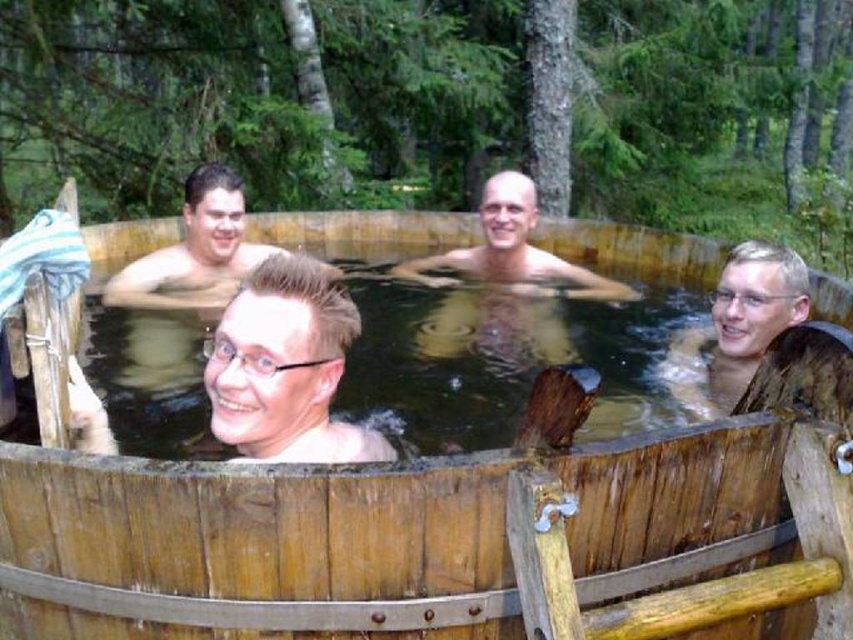
Can you confirm if smooth skin at right is thinner than matte skin at center?

Correct, smooth skin at right's width is less than matte skin at center's.

Does smooth skin at right have a greater width compared to matte skin at center?

Incorrect, smooth skin at right's width does not surpass matte skin at center's.

Describe the element at coordinates (737, 326) in the screenshot. This screenshot has height=640, width=853. I see `smooth skin at right` at that location.

Where is `smooth skin at right`? The width and height of the screenshot is (853, 640). smooth skin at right is located at coordinates (737, 326).

Can you confirm if wooden hot tub at center is positioned to the right of clear plastic glasses at center?

Correct, you'll find wooden hot tub at center to the right of clear plastic glasses at center.

Which is in front, point (129, 509) or point (276, 390)?

Point (129, 509) is more forward.

I want to click on wooden hot tub at center, so click(254, 548).

Can you confirm if smooth skin at right is bigger than smooth skin man at center?

Incorrect, smooth skin at right is not larger than smooth skin man at center.

Can you confirm if smooth skin at right is wider than smooth skin man at center?

In fact, smooth skin at right might be narrower than smooth skin man at center.

The width and height of the screenshot is (853, 640). I want to click on smooth skin at right, so click(737, 326).